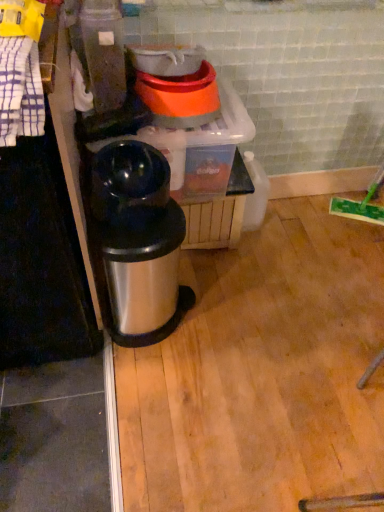
Where is `vacant area that is situated to the right of shiny metallic trash can at center`? vacant area that is situated to the right of shiny metallic trash can at center is located at coordinates (231, 312).